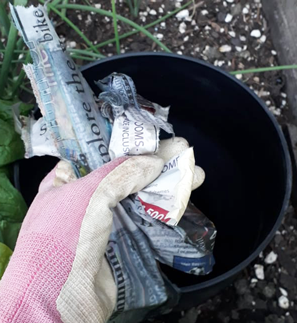
You are a GUI agent. You are given a task and a screenshot of the screen. Output one action in this format:
    pyautogui.click(x=<x>, y=<y>)
    Task: Click on the plant
    This screenshot has width=297, height=323.
    Given the screenshot: What is the action you would take?
    pyautogui.click(x=8, y=45)